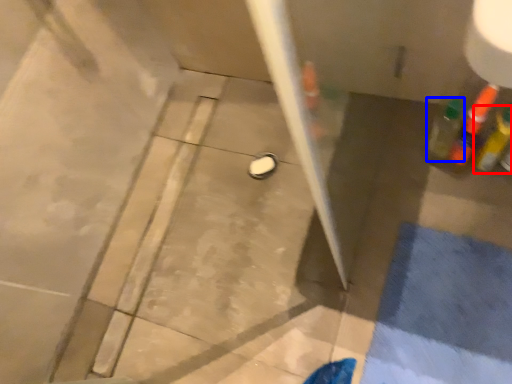
Question: Which object appears farthest to the camera in this image, bottle (highlighted by a red box) or bottle (highlighted by a blue box)?

Choices:
 (A) bottle
 (B) bottle

Answer: (B)